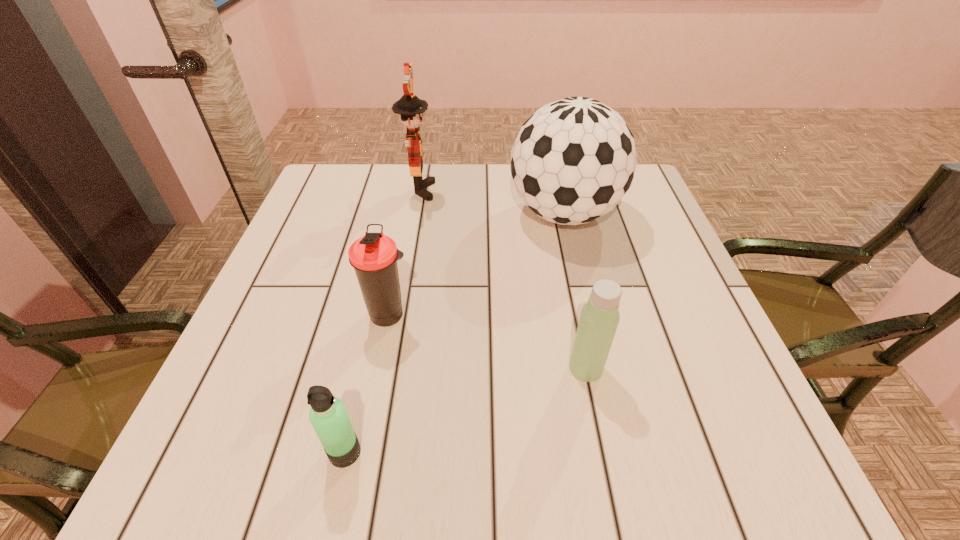
The width and height of the screenshot is (960, 540). In the image, there is a desktop. What are the coordinates of `vacant space at the near left corner` in the screenshot? It's located at (280, 444).

I want to click on vacant space at the far right corner of the desktop, so click(634, 192).

Find the location of a particular element. The width and height of the screenshot is (960, 540). vacant space at the near right corner of the desktop is located at coordinates (684, 482).

Where is `vacant space that is in between the fourth farthest object and the soccer ball`? vacant space that is in between the fourth farthest object and the soccer ball is located at coordinates (575, 291).

Identify the location of vacant point located between the third farthest object and the nutcracker. The width and height of the screenshot is (960, 540). (404, 253).

The image size is (960, 540). What are the coordinates of `vacant space that is in between the nearest thermos bottle and the second nearest object` in the screenshot? It's located at (466, 410).

The width and height of the screenshot is (960, 540). I want to click on free space between the nutcracker and the second farthest thermos bottle, so click(502, 279).

Locate an element on the screen. The height and width of the screenshot is (540, 960). vacant area that lies between the third farthest object and the nutcracker is located at coordinates (404, 253).

What are the coordinates of `free point between the nutcracker and the rightmost thermos bottle` in the screenshot? It's located at (502, 279).

At what (x,y) coordinates should I click in order to perform the action: click on vacant area that lies between the nearest thermos bottle and the rightmost thermos bottle. Please return your answer as a coordinate pair (x, y). This screenshot has height=540, width=960. Looking at the image, I should click on (466, 410).